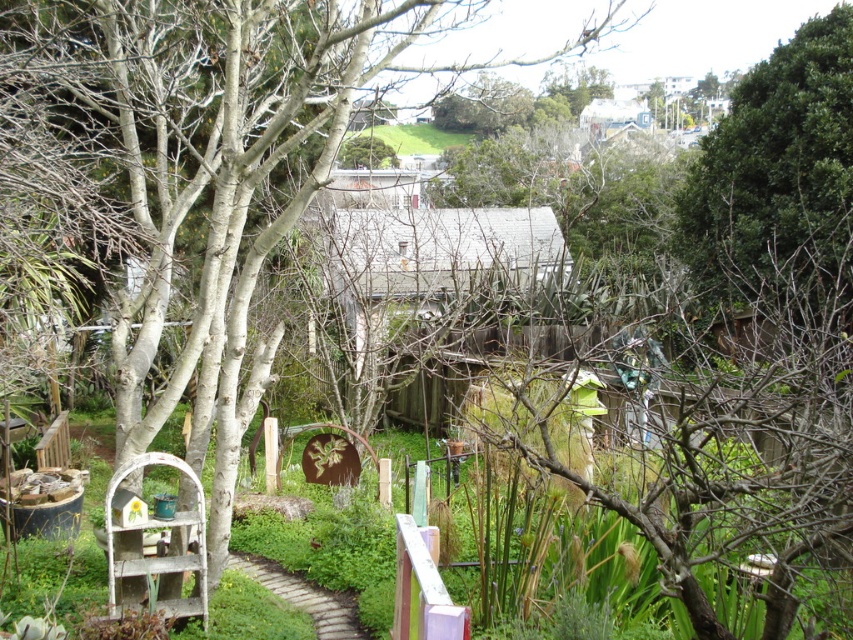
Question: Is green leafy tree at upper right to the left of brown brick path at lower center from the viewer's perspective?

Choices:
 (A) yes
 (B) no

Answer: (B)

Question: Which point appears closest to the camera in this image?

Choices:
 (A) (837, 164)
 (B) (239, 560)

Answer: (B)

Question: Is green leafy tree at upper right further to camera compared to brown brick path at lower center?

Choices:
 (A) no
 (B) yes

Answer: (B)

Question: Does green leafy tree at upper right lie in front of brown brick path at lower center?

Choices:
 (A) yes
 (B) no

Answer: (B)

Question: Which object appears closest to the camera in this image?

Choices:
 (A) brown brick path at lower center
 (B) green leafy tree at upper right

Answer: (A)

Question: Among these objects, which one is nearest to the camera?

Choices:
 (A) brown brick path at lower center
 (B) green leafy tree at upper right

Answer: (A)